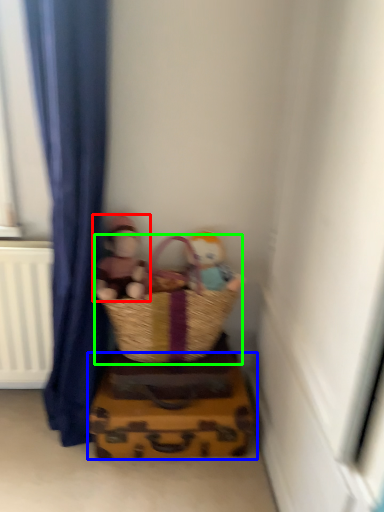
Question: Based on their relative distances, which object is nearer to person (highlighted by a red box)? Choose from crate (highlighted by a blue box) and picnic basket (highlighted by a green box).

Choices:
 (A) crate
 (B) picnic basket

Answer: (B)